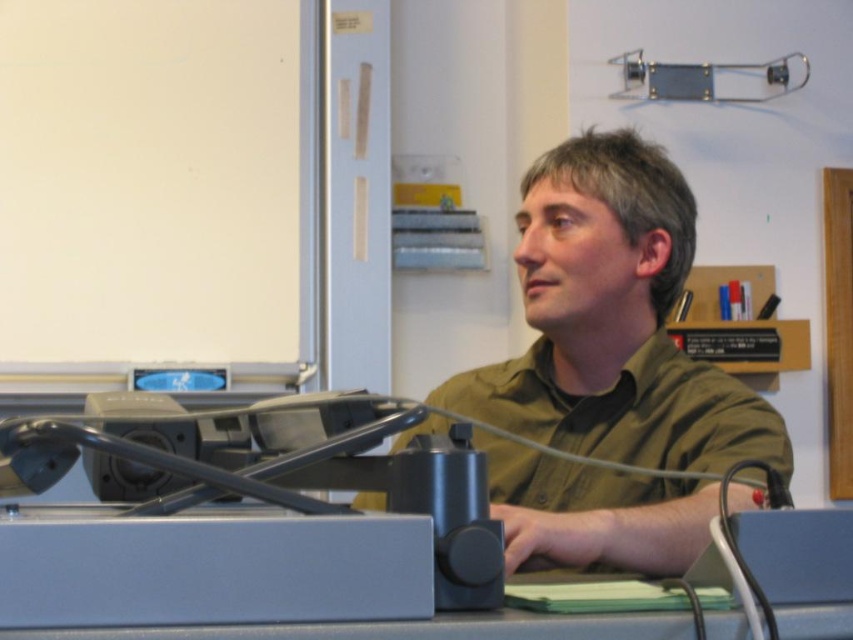
Who is shorter, green matte shirt at center or gray matte table at center?

With less height is gray matte table at center.

This screenshot has width=853, height=640. What do you see at coordinates (613, 321) in the screenshot?
I see `green matte shirt at center` at bounding box center [613, 321].

Which is behind, point (489, 388) or point (683, 630)?

The point (489, 388) is behind.

This screenshot has width=853, height=640. I want to click on green matte shirt at center, so click(613, 321).